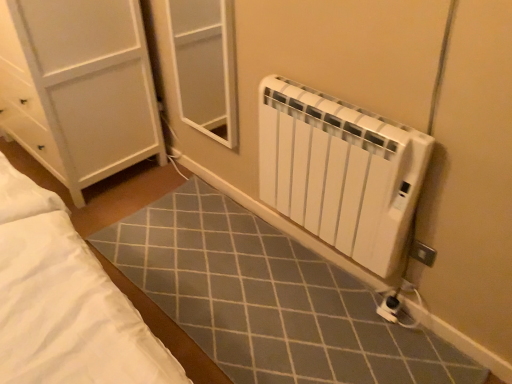
The width and height of the screenshot is (512, 384). What do you see at coordinates (340, 171) in the screenshot? I see `white plastic radiator at lower right` at bounding box center [340, 171].

Identify the location of white plastic radiator at lower right. (340, 171).

The image size is (512, 384). What do you see at coordinates (422, 253) in the screenshot?
I see `white plastic electric outlet at lower right` at bounding box center [422, 253].

Image resolution: width=512 pixels, height=384 pixels. What are the coordinates of `white plastic electric outlet at lower right` in the screenshot? It's located at (422, 253).

At what (x,y) coordinates should I click in order to perform the action: click on white plastic radiator at lower right. Please return your answer as a coordinate pair (x, y). The image size is (512, 384). Looking at the image, I should click on (340, 171).

Considering the relative positions of white plastic electric outlet at lower right and white plastic radiator at lower right in the image provided, is white plastic electric outlet at lower right to the right of white plastic radiator at lower right from the viewer's perspective?

Yes, white plastic electric outlet at lower right is to the right of white plastic radiator at lower right.

Considering the relative positions of white plastic electric outlet at lower right and white plastic radiator at lower right in the image provided, is white plastic electric outlet at lower right behind white plastic radiator at lower right?

Yes, white plastic electric outlet at lower right is further from the camera.

Which is behind, point (436, 251) or point (354, 162)?

The point (436, 251) is behind.

From the image's perspective, is white plastic electric outlet at lower right positioned above or below white plastic radiator at lower right?

Based on their image positions, white plastic electric outlet at lower right is located beneath white plastic radiator at lower right.

From a real-world perspective, is white plastic electric outlet at lower right positioned above or below white plastic radiator at lower right?

From a real-world perspective, white plastic electric outlet at lower right is physically below white plastic radiator at lower right.

Between white plastic electric outlet at lower right and white plastic radiator at lower right, which one has larger width?

white plastic radiator at lower right is wider.

Considering the sizes of objects white plastic electric outlet at lower right and white plastic radiator at lower right in the image provided, who is shorter, white plastic electric outlet at lower right or white plastic radiator at lower right?

Standing shorter between the two is white plastic electric outlet at lower right.

Does white plastic electric outlet at lower right have a smaller size compared to white plastic radiator at lower right?

Indeed, white plastic electric outlet at lower right has a smaller size compared to white plastic radiator at lower right.

Is white plastic electric outlet at lower right positioned beyond the bounds of white plastic radiator at lower right?

Yes.

Are white plastic electric outlet at lower right and white plastic radiator at lower right located far from each other?

They are positioned close to each other.

Is white plastic electric outlet at lower right looking in the opposite direction of white plastic radiator at lower right?

No, white plastic electric outlet at lower right is not facing away from white plastic radiator at lower right.

How many degrees apart are the facing directions of white plastic electric outlet at lower right and white plastic radiator at lower right?

The facing directions of white plastic electric outlet at lower right and white plastic radiator at lower right are 0.911 degrees apart.

Measure the distance from white plastic electric outlet at lower right to white plastic radiator at lower right.

The distance of white plastic electric outlet at lower right from white plastic radiator at lower right is 39.66 centimeters.

Identify the location of electric outlet that appears behind the white plastic radiator at lower right. The width and height of the screenshot is (512, 384). (422, 253).

Can you confirm if white plastic radiator at lower right is positioned to the right of white plastic electric outlet at lower right?

In fact, white plastic radiator at lower right is to the left of white plastic electric outlet at lower right.

Considering the positions of objects white plastic radiator at lower right and white plastic electric outlet at lower right in the image provided, who is behind, white plastic radiator at lower right or white plastic electric outlet at lower right?

white plastic electric outlet at lower right is further from the camera.

Considering the positions of points (280, 184) and (436, 255), is point (280, 184) farther from camera compared to point (436, 255)?

Yes.

From the image's perspective, relative to white plastic electric outlet at lower right, is white plastic radiator at lower right above or below?

Based on their image positions, white plastic radiator at lower right is located above white plastic electric outlet at lower right.

From a real-world perspective, is white plastic radiator at lower right positioned under white plastic electric outlet at lower right based on gravity?

Incorrect, from a real-world perspective, white plastic radiator at lower right is higher than white plastic electric outlet at lower right.

Between white plastic radiator at lower right and white plastic electric outlet at lower right, which one has larger width?

white plastic radiator at lower right is wider.

Considering the sizes of objects white plastic radiator at lower right and white plastic electric outlet at lower right in the image provided, who is taller, white plastic radiator at lower right or white plastic electric outlet at lower right?

Standing taller between the two is white plastic radiator at lower right.

Is white plastic radiator at lower right smaller than white plastic electric outlet at lower right?

Actually, white plastic radiator at lower right might be larger than white plastic electric outlet at lower right.

Is white plastic radiator at lower right not inside white plastic electric outlet at lower right?

That's correct, white plastic radiator at lower right is outside of white plastic electric outlet at lower right.

Consider the image. Is the surface of white plastic radiator at lower right in direct contact with white plastic electric outlet at lower right?

white plastic radiator at lower right and white plastic electric outlet at lower right are not in contact.

Is white plastic electric outlet at lower right at the back of white plastic radiator at lower right?

No, white plastic radiator at lower right is not facing the opposite direction of white plastic electric outlet at lower right.

Can you tell me how much white plastic radiator at lower right and white plastic electric outlet at lower right differ in facing direction?

The facing directions of white plastic radiator at lower right and white plastic electric outlet at lower right are 0.911 degrees apart.

How distant is white plastic radiator at lower right from white plastic electric outlet at lower right?

15.61 inches.

Where is `radiator in front of the white plastic electric outlet at lower right`? radiator in front of the white plastic electric outlet at lower right is located at coordinates (340, 171).

Where is `electric outlet below the white plastic radiator at lower right (from the image's perspective)`? This screenshot has height=384, width=512. electric outlet below the white plastic radiator at lower right (from the image's perspective) is located at coordinates (422, 253).

What are the coordinates of `radiator above the white plastic electric outlet at lower right (from a real-world perspective)` in the screenshot? It's located at (340, 171).